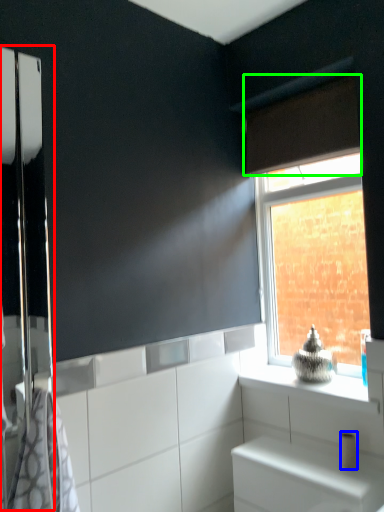
Question: Considering the real-world distances, which object is farthest from screen door (highlighted by a red box)? toilet paper (highlighted by a blue box) or curtain (highlighted by a green box)?

Choices:
 (A) toilet paper
 (B) curtain

Answer: (A)